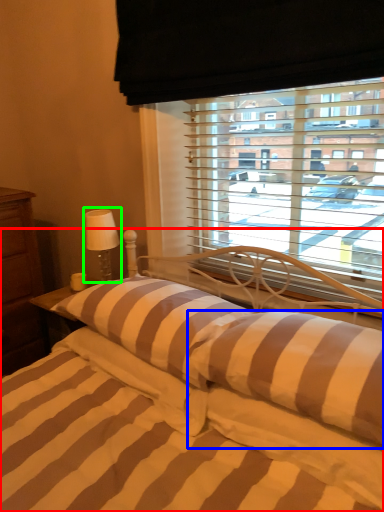
Question: Which is farther away from bed (highlighted by a red box)? pillow (highlighted by a blue box) or table lamp (highlighted by a green box)?

Choices:
 (A) pillow
 (B) table lamp

Answer: (B)